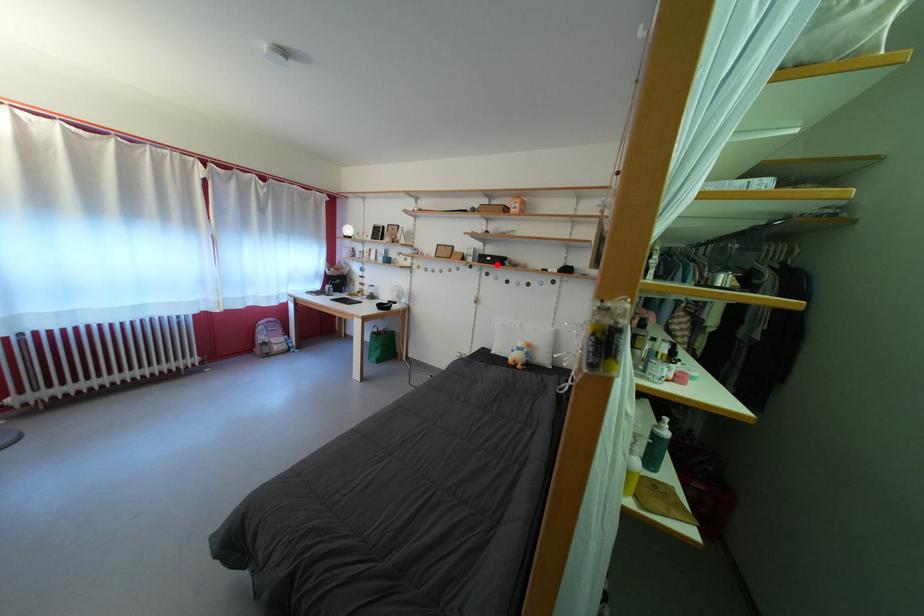
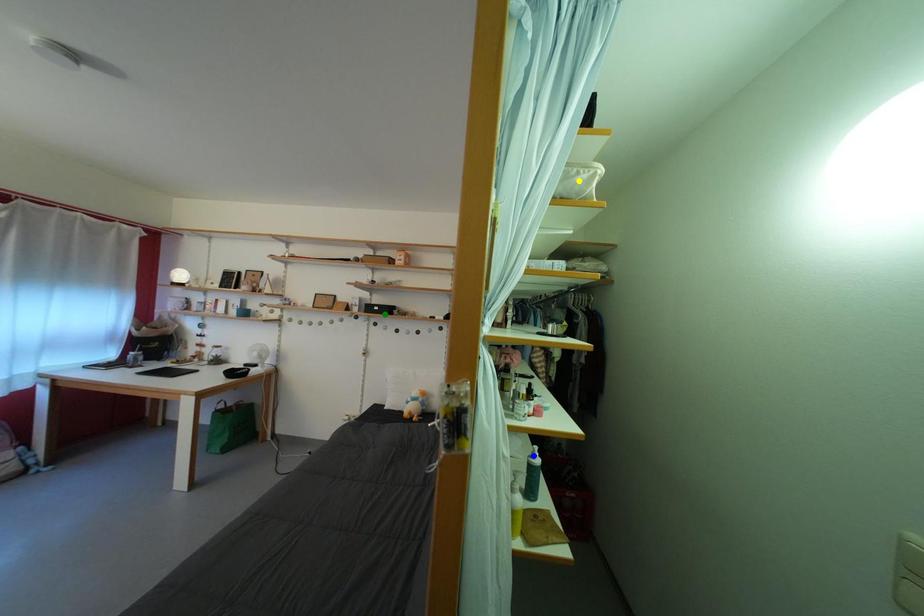
Question: I am providing you with two images of the same scene from different viewpoints. A red point is marked on the first image. You are given multiple points on the second image. In image 2, which mark is for the same physical point as the one in image 1?

Choices:
 (A) yellow point
 (B) green point
 (C) blue point

Answer: (B)